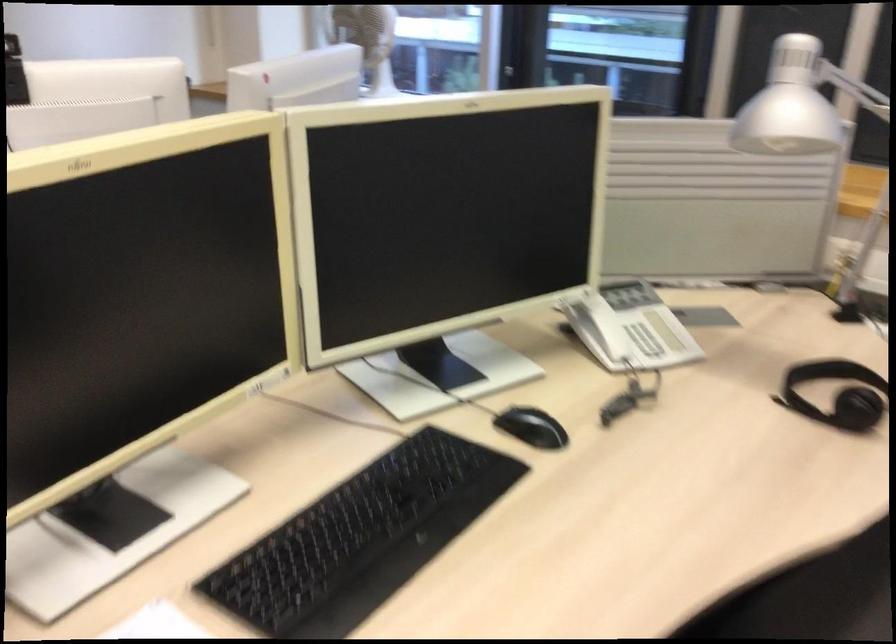
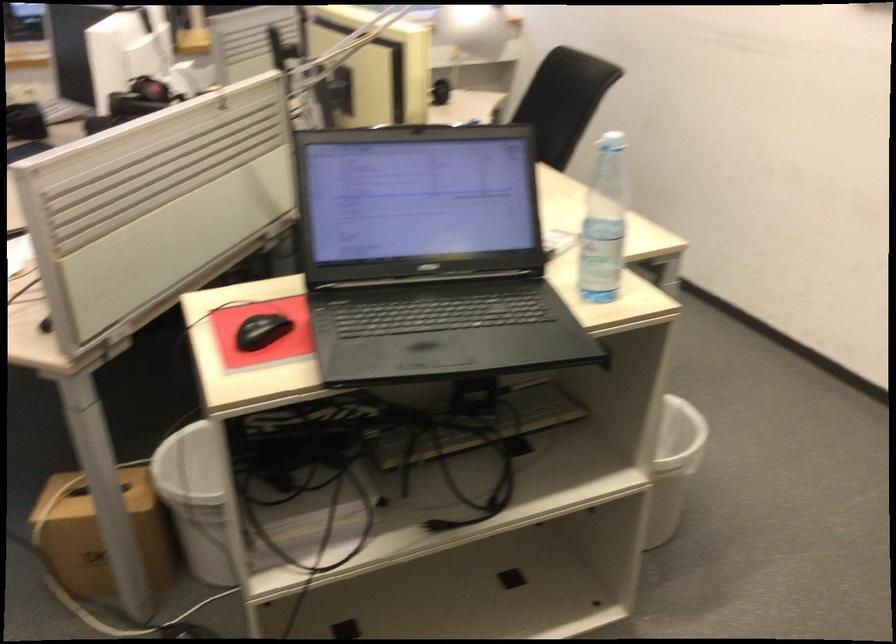
Question: I am providing you with two images of the same scene from different viewpoints. Which of the following objects are not visible in image2?

Choices:
 (A) brown cardboard box
 (B) telephone handset
 (C) plastic water bottle
 (D) blue and red box

Answer: (B)